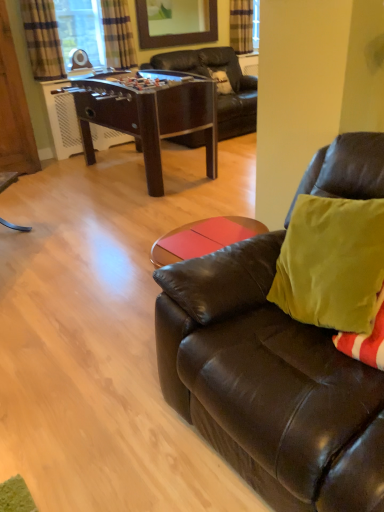
Identify the location of free space in front of brown wooden foosball table at center. Image resolution: width=384 pixels, height=512 pixels. click(x=110, y=222).